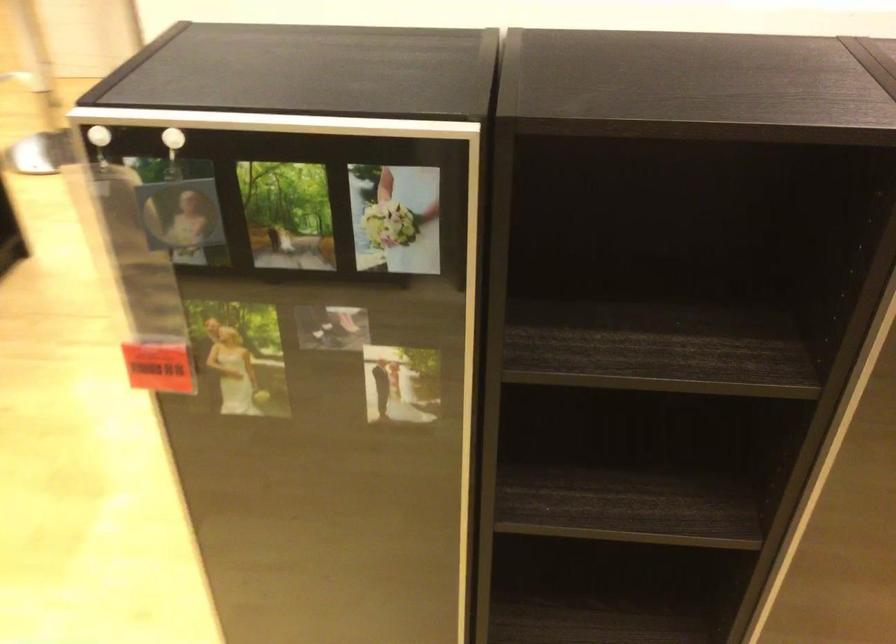
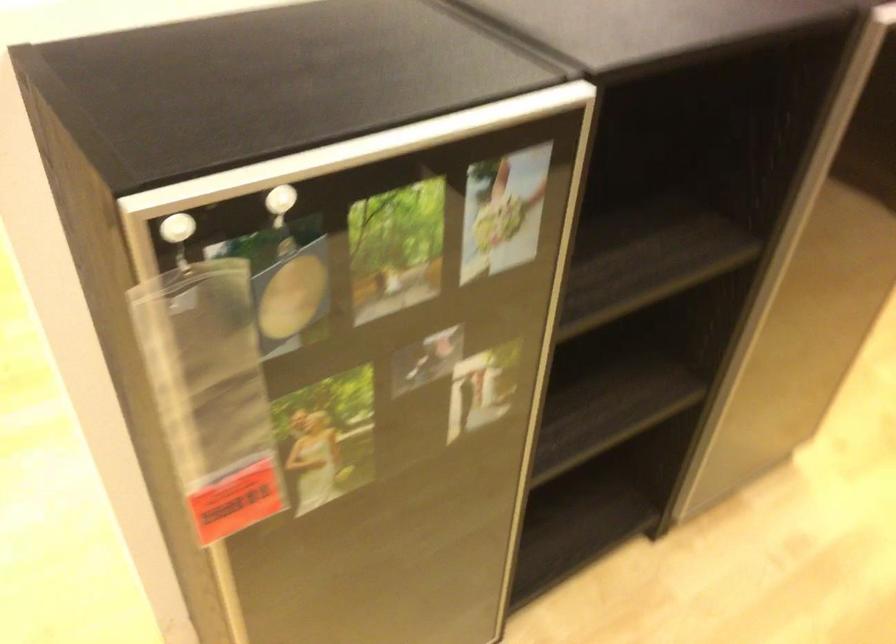
Find the pixel in the second image that matches (247,120) in the first image.

(356, 152)